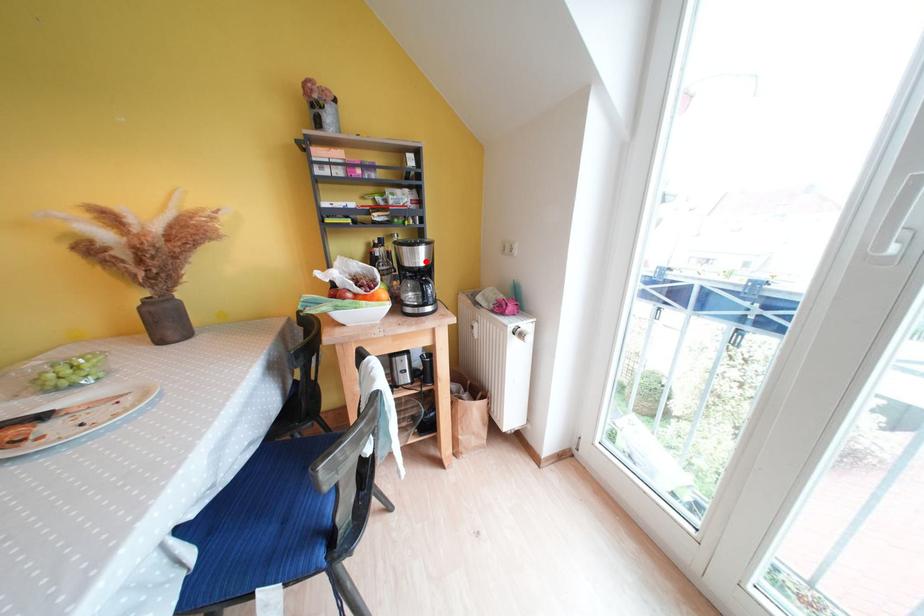
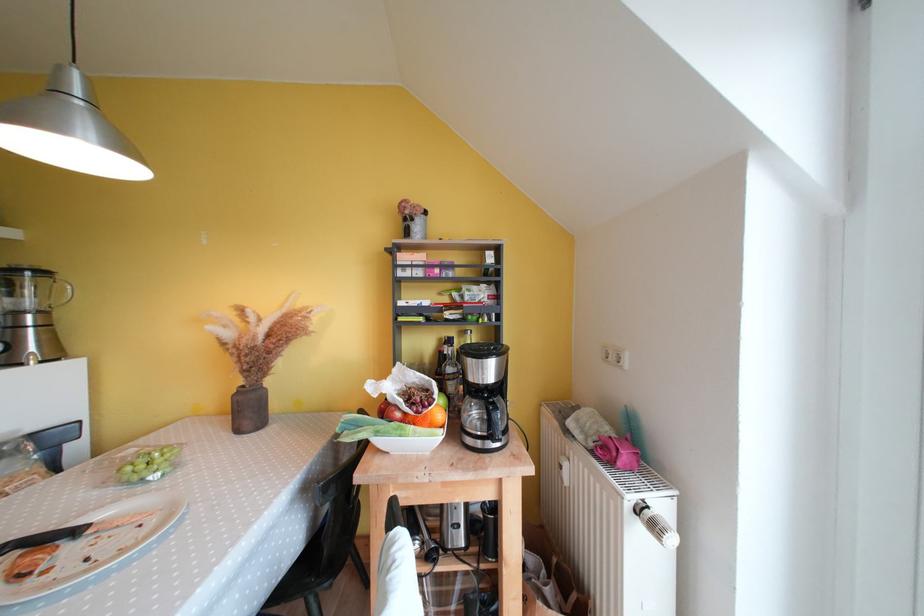
The point at the highlighted location is marked in the first image. Where is the corresponding point in the second image?

(494, 376)